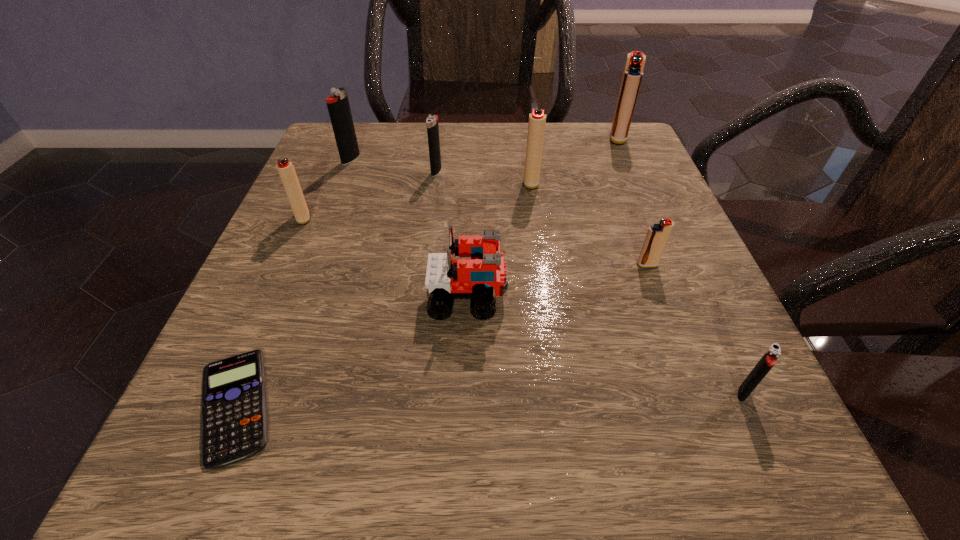
Locate an element on the screen. Image resolution: width=960 pixels, height=540 pixels. the tallest igniter is located at coordinates (633, 72).

Find the location of a particular element. Image resolution: width=960 pixels, height=540 pixels. the farthest object is located at coordinates (633, 72).

This screenshot has height=540, width=960. I want to click on the third smallest red igniter, so (536, 127).

Identify the location of the fourth object from right to left. (536, 127).

At what (x,y) coordinates should I click in order to perform the action: click on the leftmost black igniter. Please return your answer as a coordinate pair (x, y). This screenshot has height=540, width=960. Looking at the image, I should click on (338, 105).

This screenshot has width=960, height=540. I want to click on the second farthest igniter, so click(338, 105).

Where is `the second black igniter from right to left`? The image size is (960, 540). the second black igniter from right to left is located at coordinates (432, 126).

The image size is (960, 540). I want to click on the fourth object from left to right, so click(432, 126).

This screenshot has height=540, width=960. Identify the location of the third biggest red igniter. (286, 170).

You are a GUI agent. You are given a task and a screenshot of the screen. Output one action in this format:
    pyautogui.click(x=<x>, y=<y>)
    Task: Click on the leftmost igniter
    
    Given the screenshot: What is the action you would take?
    pyautogui.click(x=286, y=170)